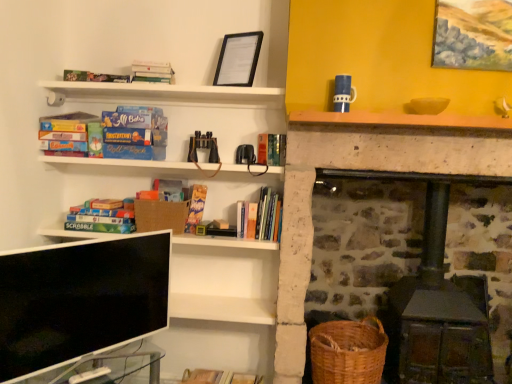
Identify the location of vacant space situated above burlap basket at lower left, placed as the 2th basket when sorted from bottom to top (from a real-world perspective). The width and height of the screenshot is (512, 384). tap(164, 192).